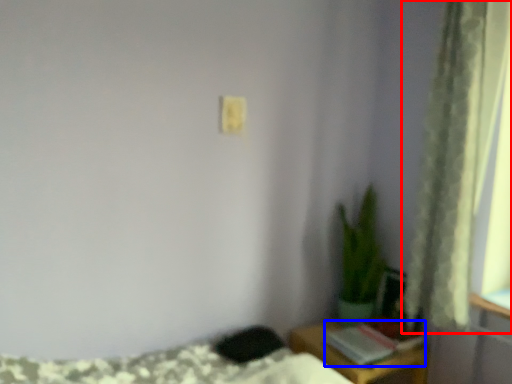
Question: Among these objects, which one is farthest to the camera, curtain (highlighted by a red box) or book (highlighted by a blue box)?

Choices:
 (A) curtain
 (B) book

Answer: (B)